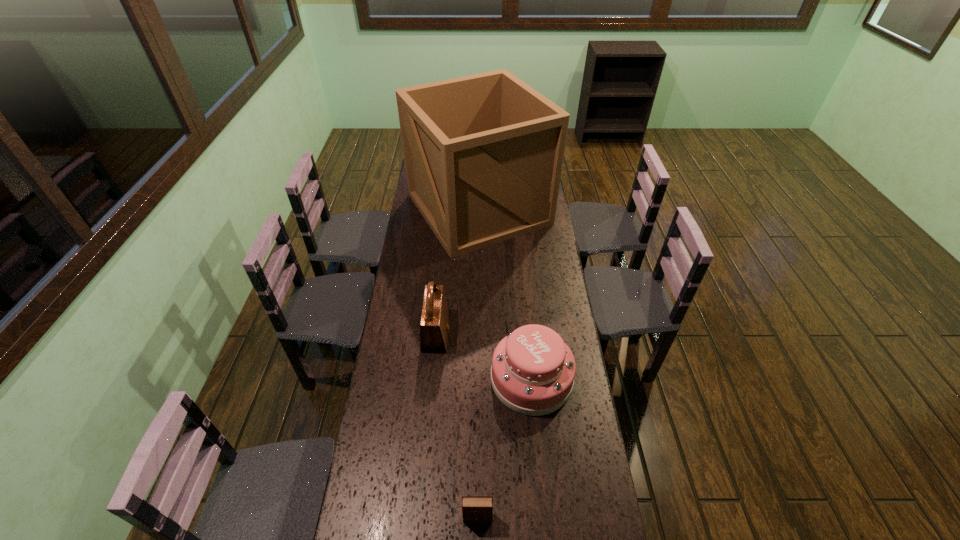
I want to click on box, so click(x=483, y=153).

I want to click on the tallest object, so [483, 153].

Where is `shoulder bag`? This screenshot has width=960, height=540. shoulder bag is located at coordinates click(434, 325).

Where is `the third tallest object`? The width and height of the screenshot is (960, 540). the third tallest object is located at coordinates (532, 373).

Locate an element on the screen. The image size is (960, 540). diary is located at coordinates (475, 509).

Locate an element on the screen. the nearest object is located at coordinates (475, 509).

Find the location of `blank space located 0.120m on the front of the box`. blank space located 0.120m on the front of the box is located at coordinates (479, 276).

Image resolution: width=960 pixels, height=540 pixels. I want to click on vacant area situated 0.400m on the front flap of the second tallest object, so click(550, 334).

You are a GUI agent. You are given a task and a screenshot of the screen. Output one action in this format:
    pyautogui.click(x=<x>, y=<y>)
    Task: Click on the vacant space located on the front of the third tallest object
    
    Given the screenshot: What is the action you would take?
    pyautogui.click(x=537, y=430)

Locate an element on the screen. object present at the far edge is located at coordinates [483, 153].